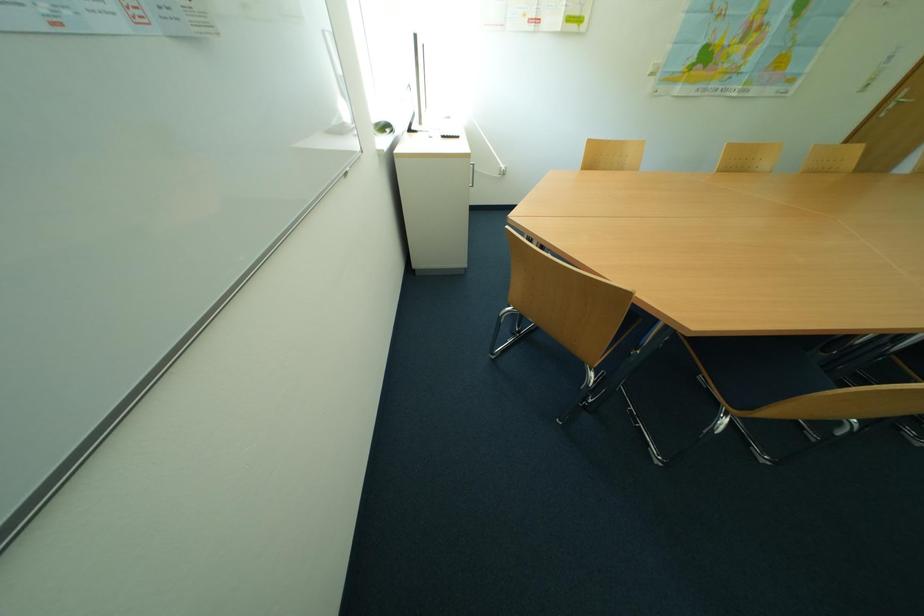
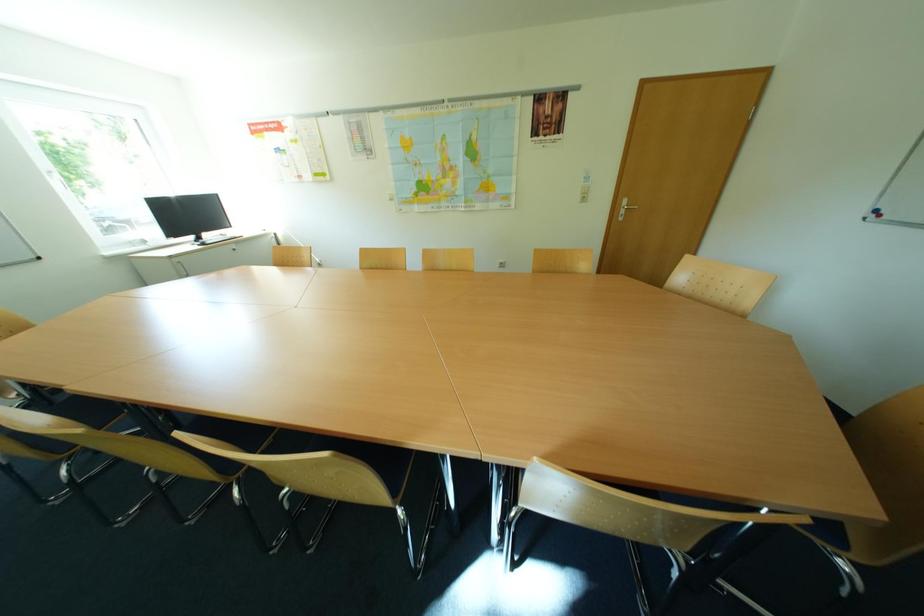
Question: Which direction would the cameraman need to move to produce the second image? Reply with the corresponding letter.

Choices:
 (A) Left
 (B) Right
 (C) Forward
 (D) Backward

Answer: (B)